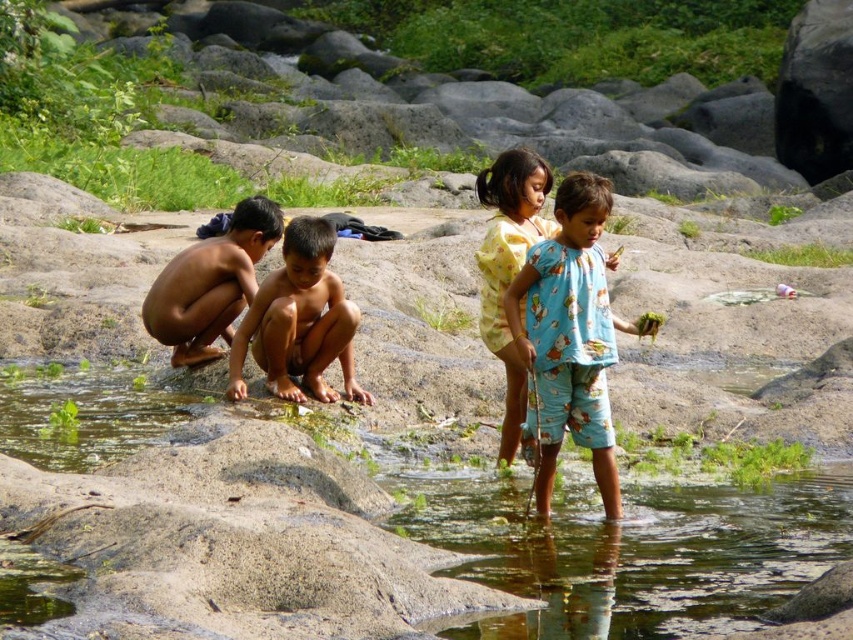
You are a photographer standing at the scene. You want to capture a clear photo of the blue cotton pajamas at center. Considering the distance, is it advisable to use a telephoto lens?

The blue cotton pajamas at center are 9.43 meters away from the camera. Using a telephoto lens would help capture a clear photo from that distance.

You are a parent supervising the children at the stream. You notice the clear water at stream center and the brown skin boy at center. Which one is taller?

The brown skin boy at center is taller than the clear water at stream center.